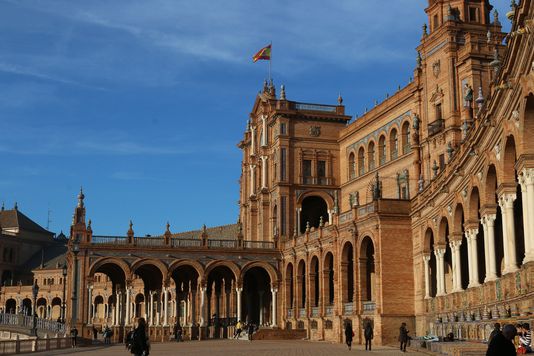
Identify the location of stairs. (244, 333).